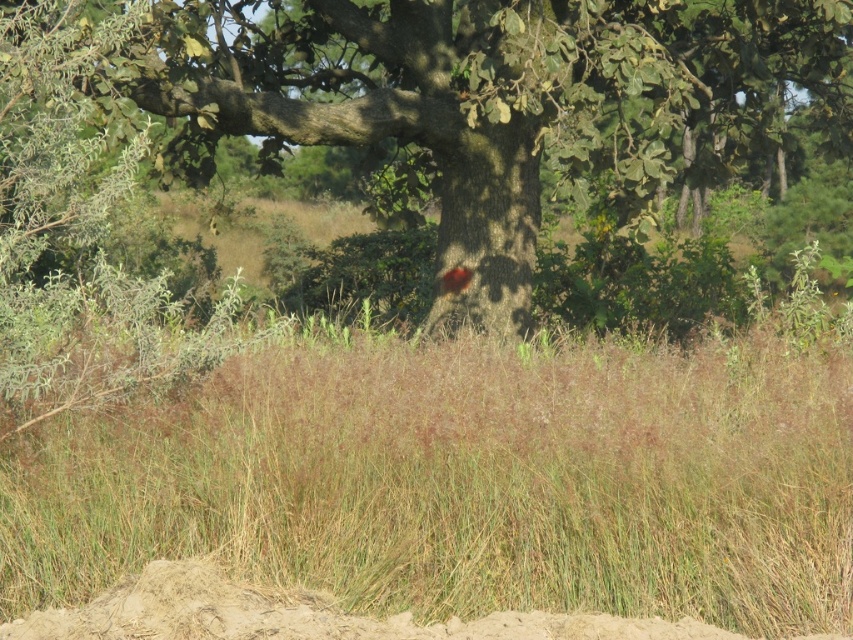
You are standing in the natural outdoor scene and want to walk from the green grass at center to the green rough bark tree at center. Which direction should you move to reach the tree?

The green grass at center is to the left of the green rough bark tree at center, so you should move to the right to reach the tree.

You are a gardener planning to mow the green grass at center and trim the green rough bark tree at center. Which task will require covering a larger area?

The green rough bark tree at center requires covering a larger area than the green grass at center because the green grass at center occupies less space than the green rough bark tree at center.